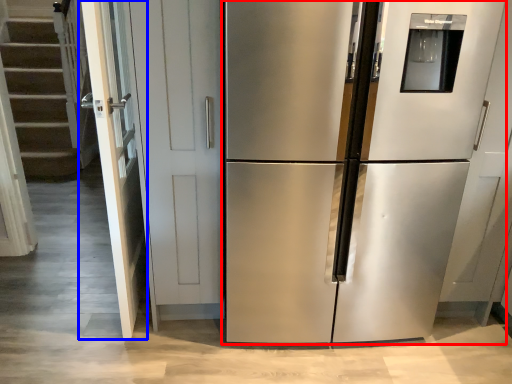
Question: Which of the following is the closest to the observer, refrigerator (highlighted by a red box) or door (highlighted by a blue box)?

Choices:
 (A) refrigerator
 (B) door

Answer: (A)